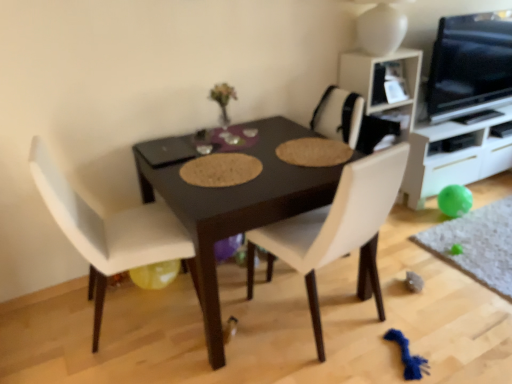
The image size is (512, 384). I want to click on free space that is in between white leather chair at left, the 1th chair in the left-to-right sequence, and dark wood table at center, so click(x=161, y=354).